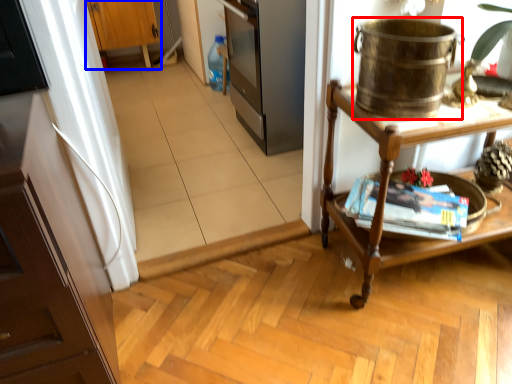
Question: Which object appears closest to the camera in this image, appliance (highlighted by a red box) or cabinetry (highlighted by a blue box)?

Choices:
 (A) appliance
 (B) cabinetry

Answer: (A)